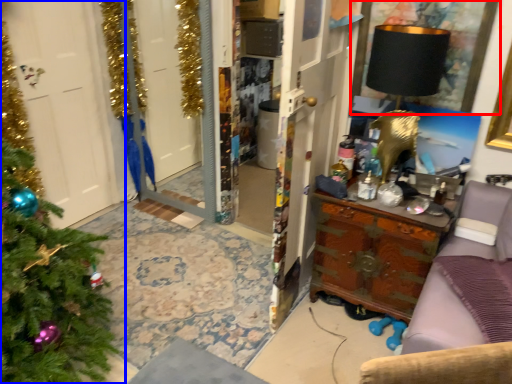
Question: Among these objects, which one is farthest to the camera, picture frame (highlighted by a red box) or christmas tree (highlighted by a blue box)?

Choices:
 (A) picture frame
 (B) christmas tree

Answer: (A)